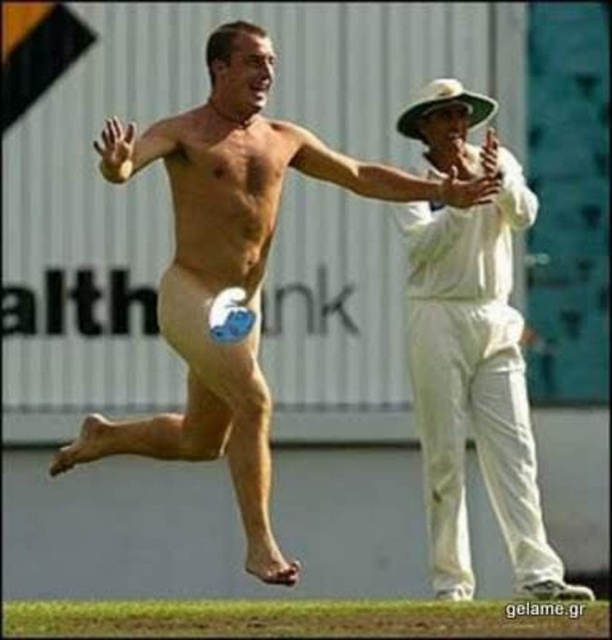
Can you confirm if skinny nude man at center is bigger than white cotton cricket uniform at right?

No.

Describe the element at coordinates (230, 268) in the screenshot. I see `skinny nude man at center` at that location.

Where is `skinny nude man at center`? The image size is (612, 640). skinny nude man at center is located at coordinates (230, 268).